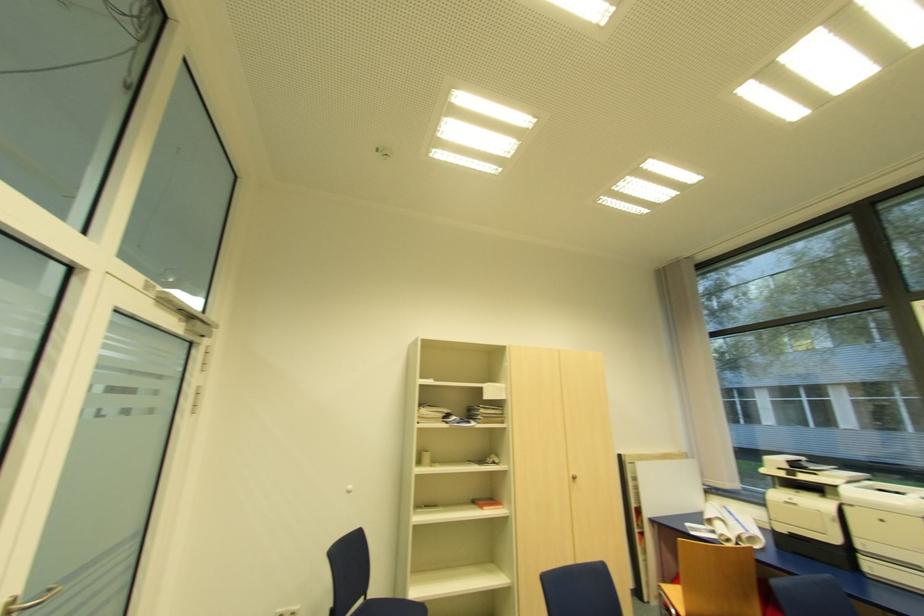
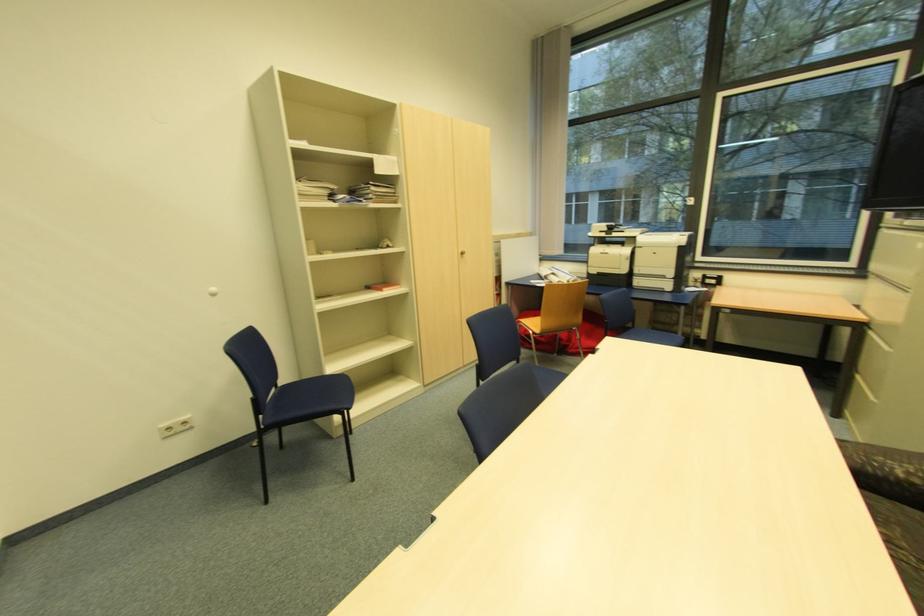
In the second image, find the point that corresponds to [576,477] in the first image.

(466, 254)